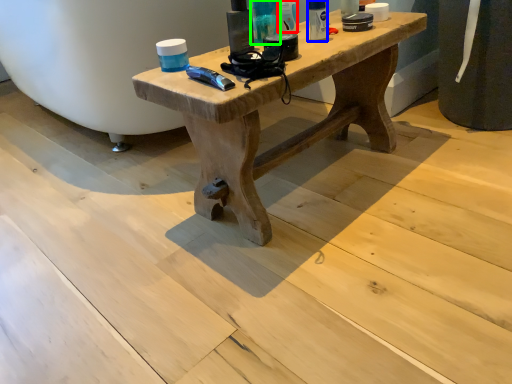
Question: Considering the real-world distances, which object is closest to toiletry (highlighted by a red box)? toiletry (highlighted by a blue box) or toiletry (highlighted by a green box).

Choices:
 (A) toiletry
 (B) toiletry

Answer: (B)